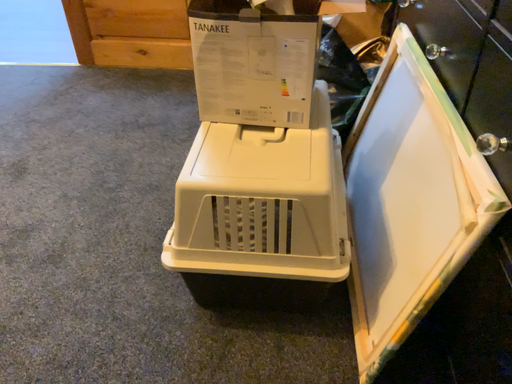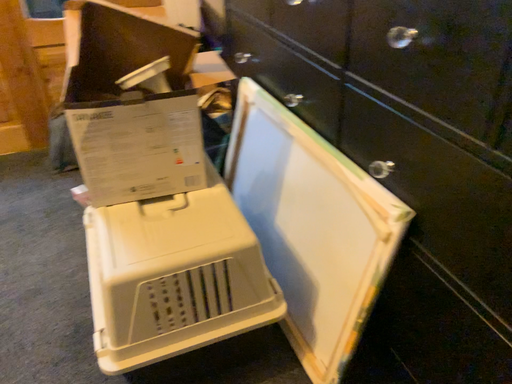
Question: How did the camera likely rotate when shooting the video?

Choices:
 (A) rotated right
 (B) rotated left

Answer: (A)